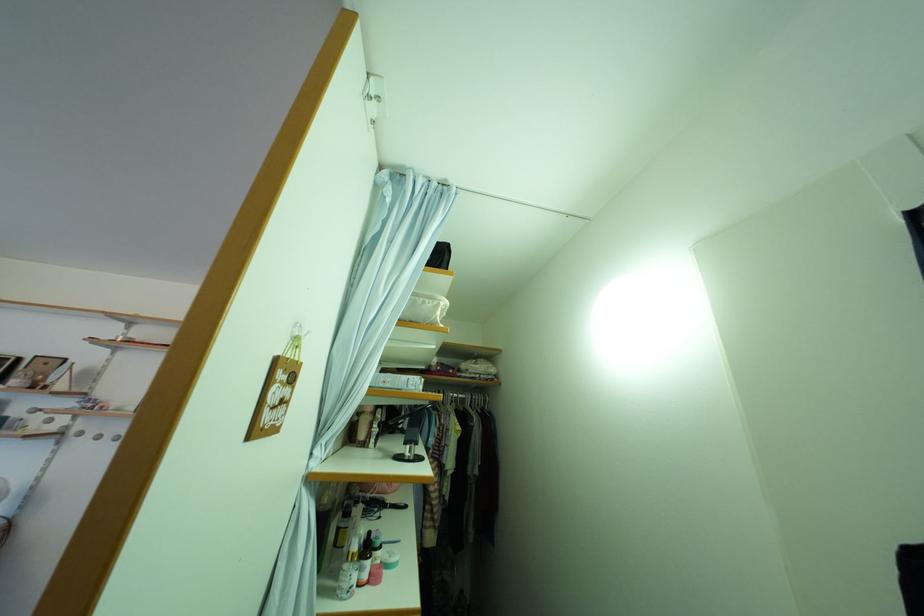
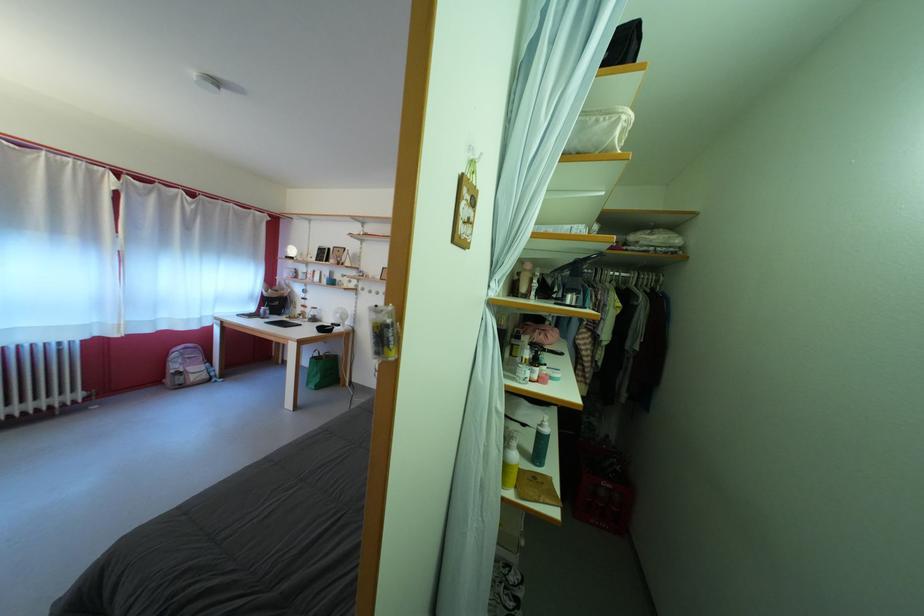
How did the camera likely rotate?

The rotation direction of the camera is left-down.